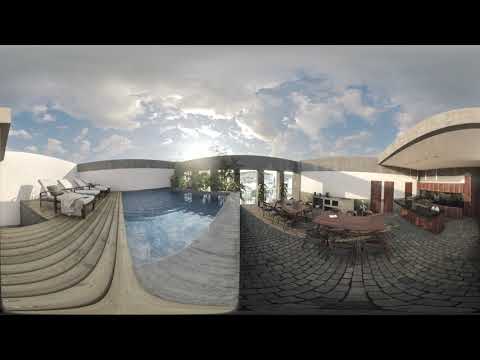
This screenshot has height=360, width=480. In order to click on chairs in this screenshot , I will do `click(83, 197)`.